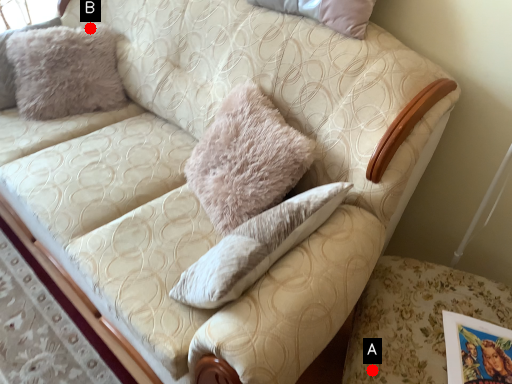
Question: Two points are circled on the image, labeled by A and B beside each circle. Among these points, which one is farthest from the camera?

Choices:
 (A) A is further
 (B) B is further

Answer: (B)